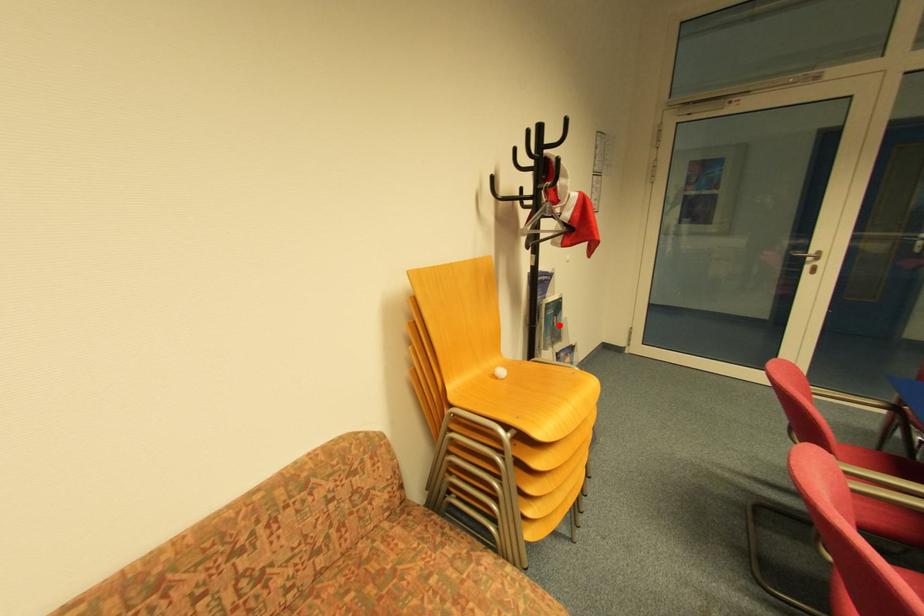
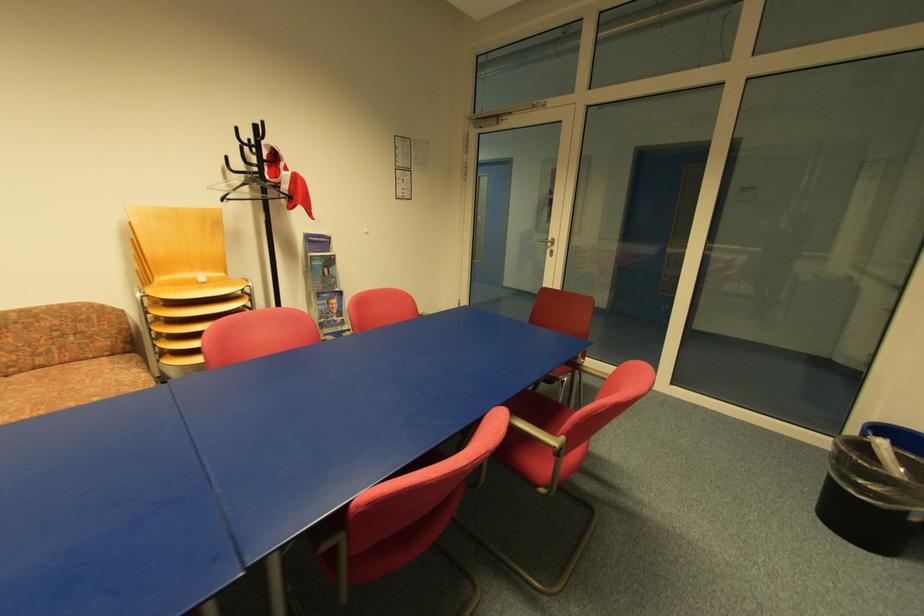
Locate, in the second image, the point that corresponds to the highlighted location in the first image.

(331, 275)